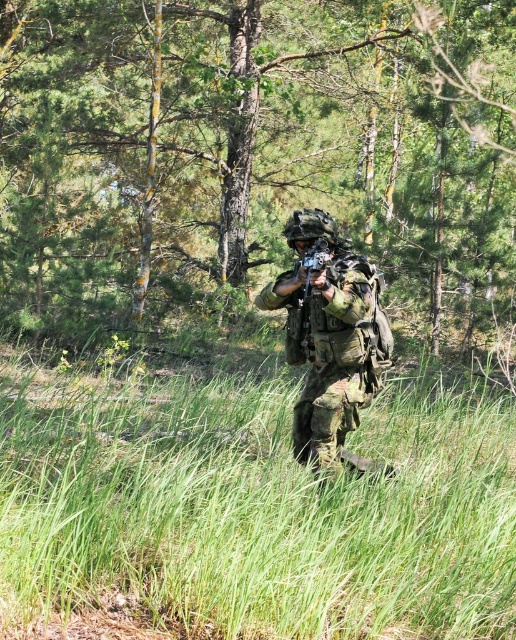
You are a soldier in a forest, aiming your matte black rifle at center. There is a green leafy tree at center in front of you. Can you see over the top of the tree with your rifle scope?

The green leafy tree at center is taller than the matte black rifle at center. Since the tree is taller, you cannot see over the top of it with your rifle scope.

You are a drone operator observing a soldier in a forest. You see the green grassy at center and the camouflage fabric uniform at center. Which object is closer to the ground?

The green grassy at center is closer to the ground because it is located below the camouflage fabric uniform at center.